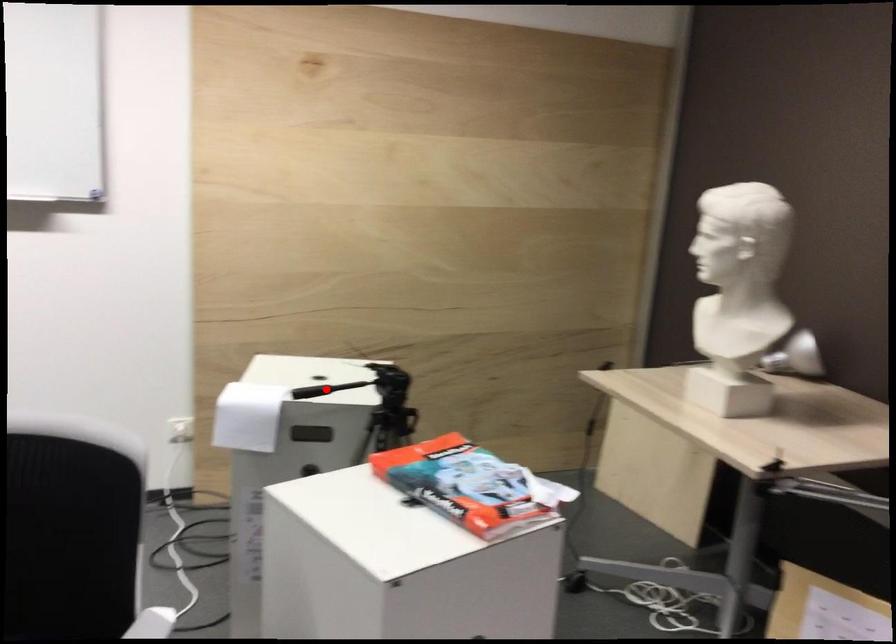
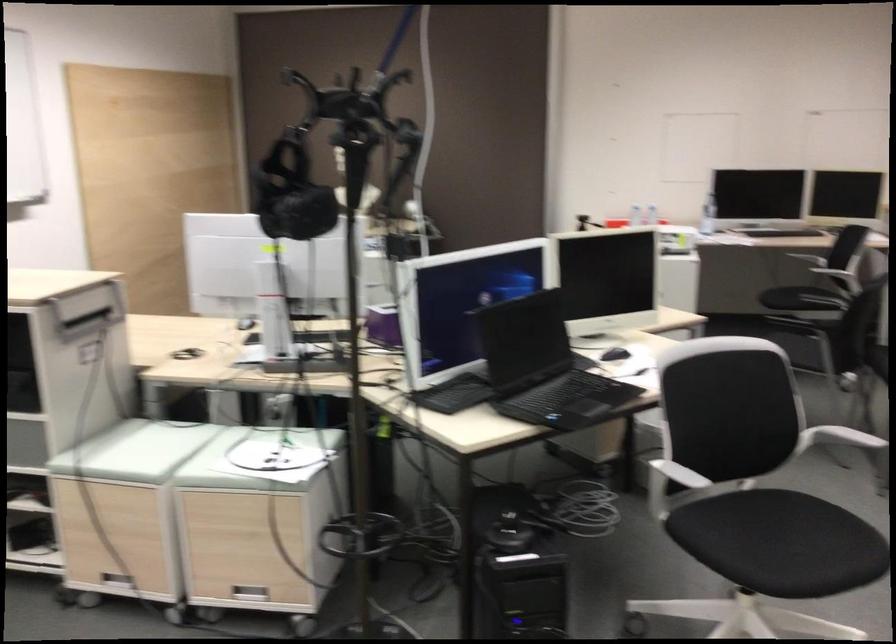
Question: I am providing you with two images of the same scene from different viewpoints. A red point is marked on the first image. Can you still see the location of the red point in image 2?

Choices:
 (A) Yes
 (B) No

Answer: (B)